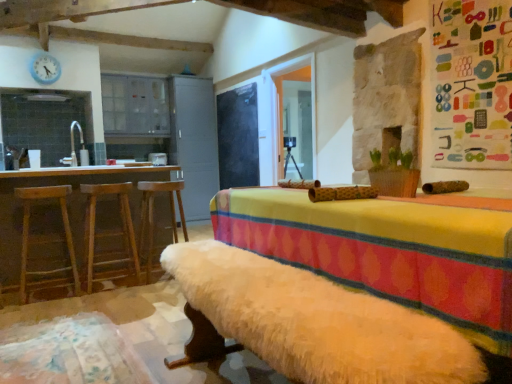
Question: Is brown wooden table at left oriented towards wooden bar stool at left, arranged as the 1th bar stool when viewed from the right?

Choices:
 (A) yes
 (B) no

Answer: (A)

Question: From a real-world perspective, is brown wooden table at left on wooden bar stool at left, arranged as the 1th bar stool when viewed from the right?

Choices:
 (A) yes
 (B) no

Answer: (A)

Question: Considering the relative positions of brown wooden table at left and wooden bar stool at left, arranged as the 1th bar stool when viewed from the right, in the image provided, is brown wooden table at left to the left of wooden bar stool at left, arranged as the 1th bar stool when viewed from the right, from the viewer's perspective?

Choices:
 (A) yes
 (B) no

Answer: (A)

Question: Does brown wooden table at left have a lesser height compared to wooden bar stool at left, the third bar stool positioned from the left?

Choices:
 (A) no
 (B) yes

Answer: (A)

Question: Considering the relative sizes of brown wooden table at left and wooden bar stool at left, the third bar stool positioned from the left, in the image provided, is brown wooden table at left taller than wooden bar stool at left, the third bar stool positioned from the left,?

Choices:
 (A) no
 (B) yes

Answer: (B)

Question: Is brown wooden table at left to the right of wooden bar stool at left, arranged as the 1th bar stool when viewed from the right, from the viewer's perspective?

Choices:
 (A) yes
 (B) no

Answer: (B)

Question: Is wooden bar stool at left, the 1th bar stool from the left, far from colorful fabric bulletin board at upper right, arranged as the 1th bulletin board when viewed from the right?

Choices:
 (A) yes
 (B) no

Answer: (A)

Question: From the image's perspective, is wooden bar stool at left, marked as the 3th bar stool in a right-to-left arrangement, beneath colorful fabric bulletin board at upper right, acting as the second bulletin board starting from the back?

Choices:
 (A) no
 (B) yes

Answer: (B)

Question: Is wooden bar stool at left, the 1th bar stool from the left, looking in the opposite direction of colorful fabric bulletin board at upper right, acting as the second bulletin board starting from the back?

Choices:
 (A) yes
 (B) no

Answer: (B)

Question: From a real-world perspective, is wooden bar stool at left, the 1th bar stool from the left, physically above colorful fabric bulletin board at upper right, arranged as the 1th bulletin board when viewed from the right?

Choices:
 (A) yes
 (B) no

Answer: (B)

Question: Is wooden bar stool at left, the 1th bar stool from the left, bigger than colorful fabric bulletin board at upper right, which is the 1th bulletin board from front to back?

Choices:
 (A) no
 (B) yes

Answer: (B)

Question: Does wooden bar stool at left, the 1th bar stool from the left, appear on the left side of colorful fabric bulletin board at upper right, acting as the second bulletin board starting from the back?

Choices:
 (A) no
 (B) yes

Answer: (B)

Question: Does transparent glass door at center have a lesser height compared to wooden bar stool at left, marked as the 3th bar stool in a right-to-left arrangement?

Choices:
 (A) yes
 (B) no

Answer: (B)